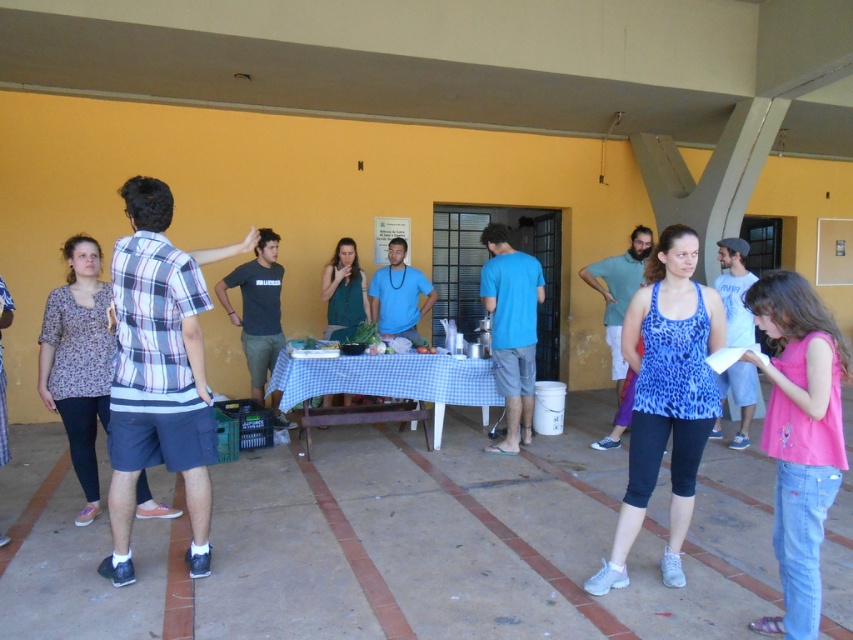
Describe the element at coordinates (389, 380) in the screenshot. I see `blue checkered tablecloth at center` at that location.

Is blue checkered tablecloth at center positioned in front of dark gray t-shirt at center?

That is True.

Does point (457, 397) come behind point (259, 337)?

No.

Locate an element on the screen. blue checkered tablecloth at center is located at coordinates (389, 380).

Between blue checkered tablecloth at center and leopard print tank top at center, which one has less height?

blue checkered tablecloth at center is shorter.

Can you confirm if blue checkered tablecloth at center is wider than leopard print tank top at center?

Correct, the width of blue checkered tablecloth at center exceeds that of leopard print tank top at center.

Between point (461, 371) and point (618, 310), which one is positioned behind?

Point (618, 310)

In order to click on blue checkered tablecloth at center in this screenshot , I will do `click(389, 380)`.

Can you confirm if pink cotton tank top at lower right is thinner than dark gray t-shirt at center?

Indeed, pink cotton tank top at lower right has a lesser width compared to dark gray t-shirt at center.

Can you confirm if pink cotton tank top at lower right is wider than dark gray t-shirt at center?

No, pink cotton tank top at lower right is not wider than dark gray t-shirt at center.

Describe the element at coordinates (799, 436) in the screenshot. I see `pink cotton tank top at lower right` at that location.

Image resolution: width=853 pixels, height=640 pixels. I want to click on pink cotton tank top at lower right, so 799,436.